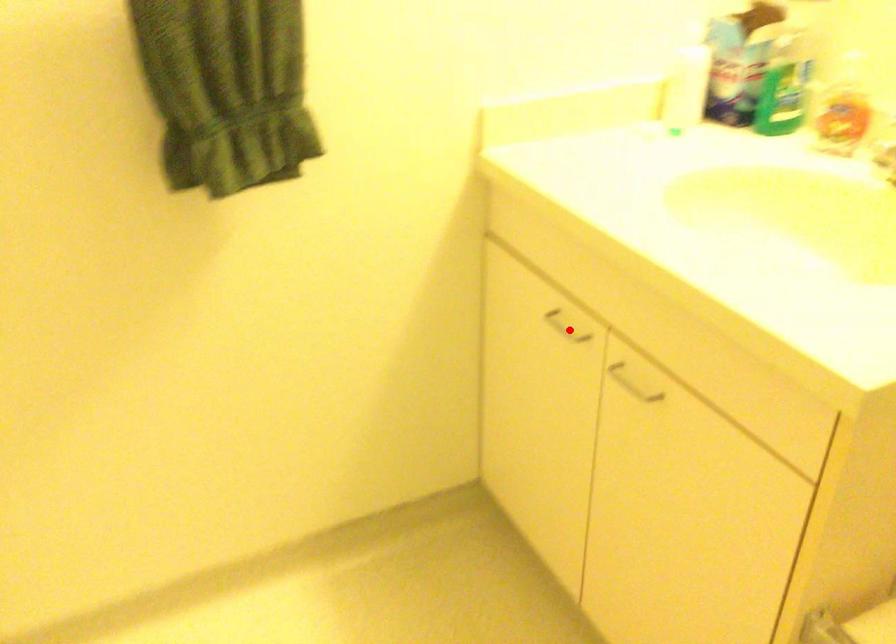
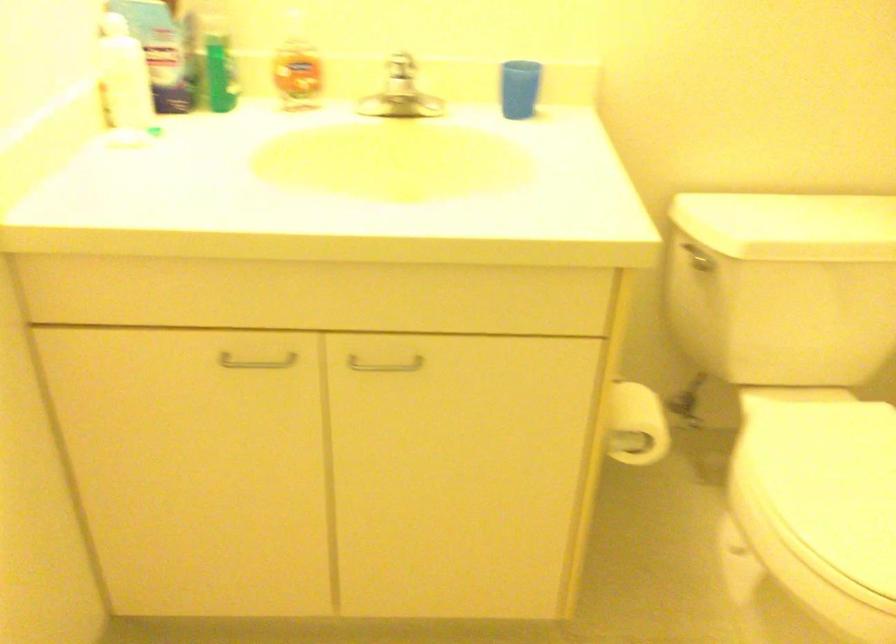
Where in the second image is the point corresponding to the highlighted location from the first image?

(256, 362)